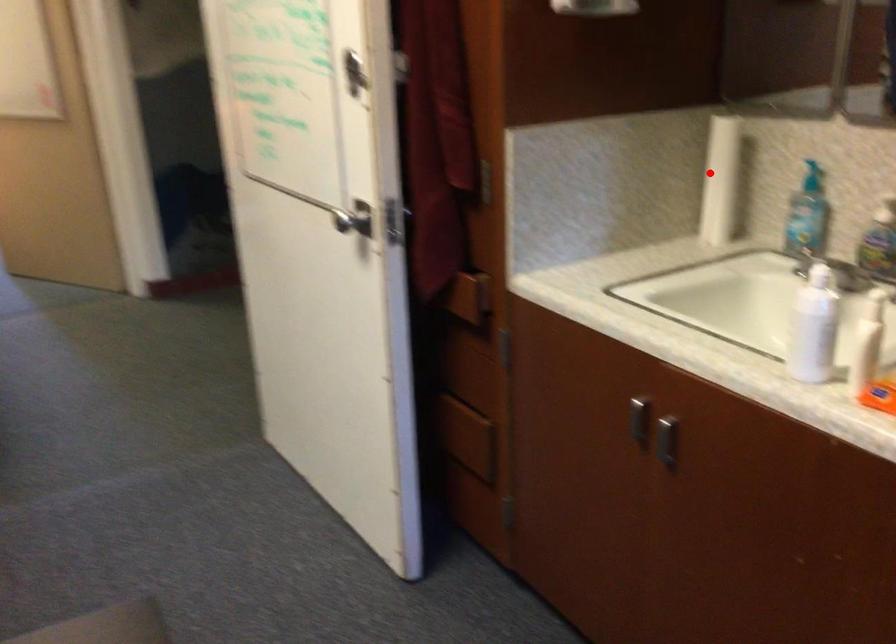
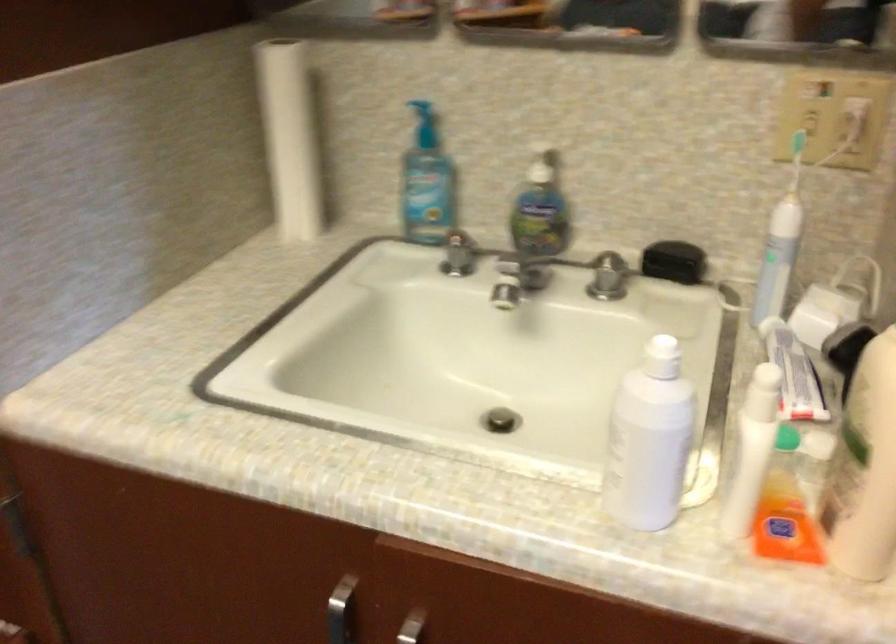
Question: I am providing you with two images of the same scene from different viewpoints. Given a red point in image1, look at the same physical point in image2. Is it:

Choices:
 (A) Closer to the viewpoint
 (B) Farther from the viewpoint

Answer: (A)